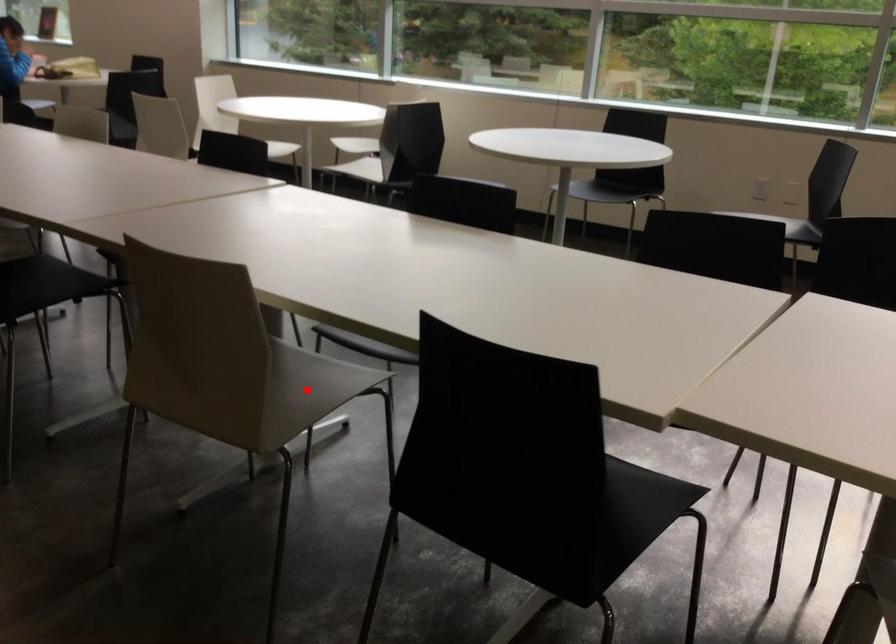
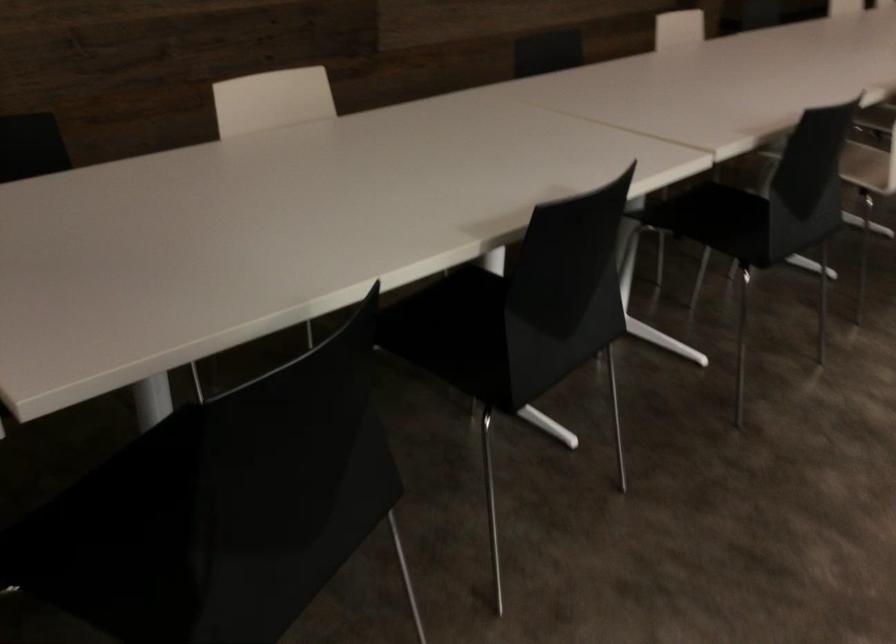
Question: I am providing you with two images of the same scene from different viewpoints. A red point is marked on the first image. Is the red point's position out of view in image 2?

Choices:
 (A) Yes
 (B) No

Answer: (A)